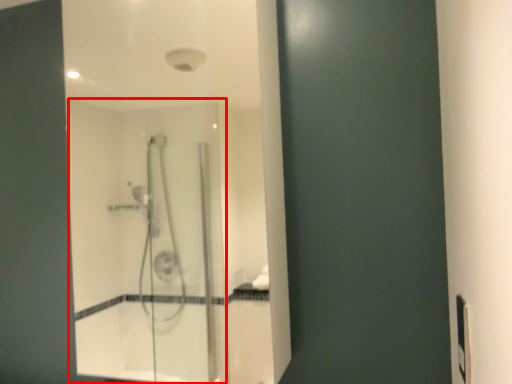
Question: In this image, where is screen door (annotated by the red box) located relative to electric outlet?

Choices:
 (A) left
 (B) right

Answer: (A)